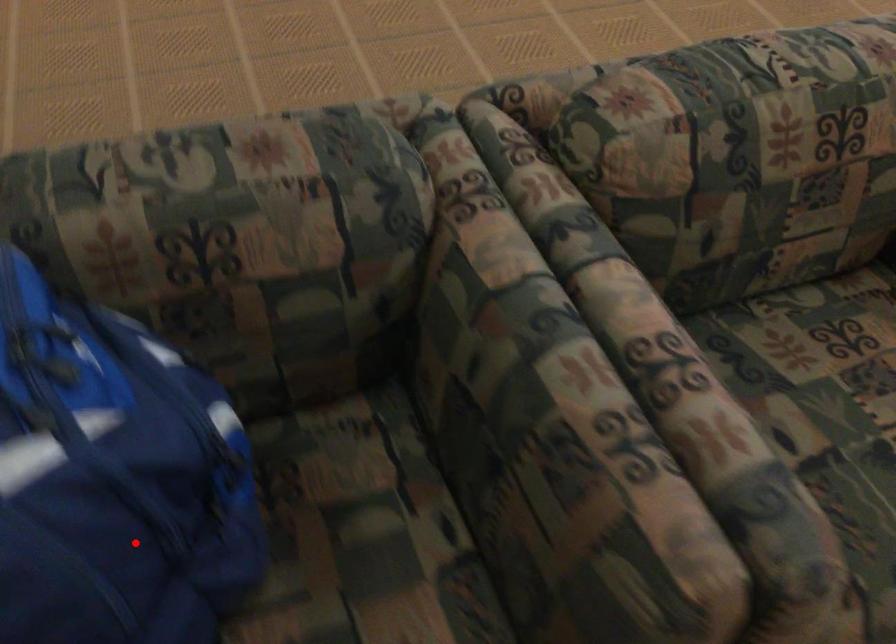
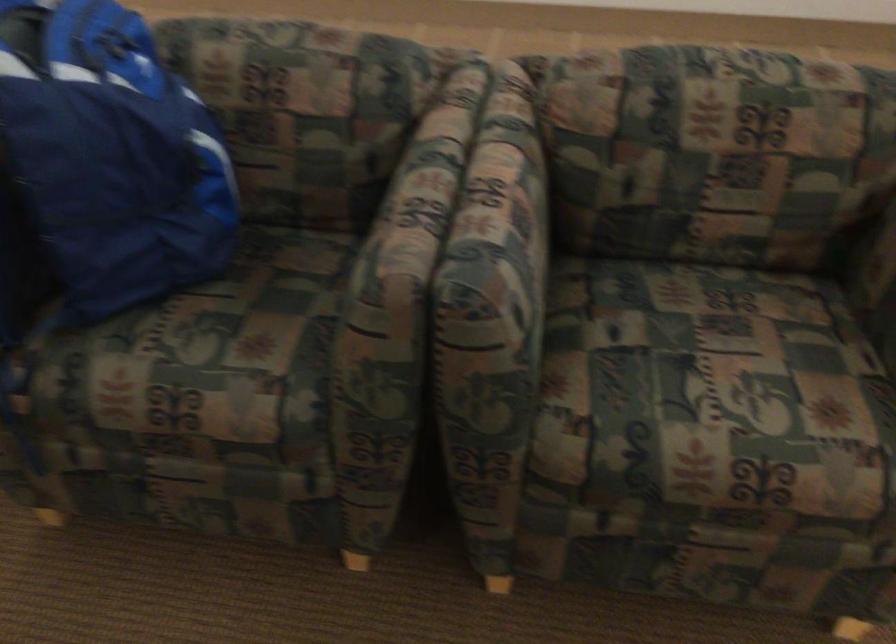
Where in the second image is the point corresponding to the highlighted location from the first image?

(112, 155)